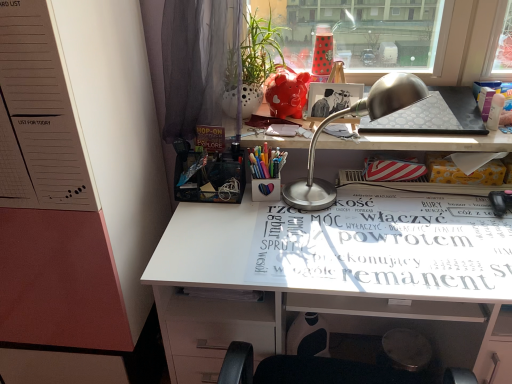
Question: Is white glossy desk at center in front of translucent plastic bottle at upper right, the second stationery from the bottom?

Choices:
 (A) no
 (B) yes

Answer: (B)

Question: From a real-world perspective, is white glossy desk at center below translucent plastic bottle at upper right, marked as the 1th stationery in a top-to-bottom arrangement?

Choices:
 (A) yes
 (B) no

Answer: (A)

Question: Can we say white glossy desk at center lies outside translucent plastic bottle at upper right, acting as the 2th stationery starting from the left?

Choices:
 (A) yes
 (B) no

Answer: (A)

Question: From the image's perspective, is white glossy desk at center below translucent plastic bottle at upper right, acting as the 2th stationery starting from the left?

Choices:
 (A) yes
 (B) no

Answer: (A)

Question: From a real-world perspective, is white glossy desk at center physically above translucent plastic bottle at upper right, acting as the 2th stationery starting from the left?

Choices:
 (A) yes
 (B) no

Answer: (B)

Question: Is point (417, 225) closer or farther from the camera than point (497, 120)?

Choices:
 (A) farther
 (B) closer

Answer: (B)

Question: In terms of height, does white paper magazine at center look taller or shorter compared to translucent plastic bottle at upper right, the second stationery from the bottom?

Choices:
 (A) tall
 (B) short

Answer: (B)

Question: Is white paper magazine at center in front of or behind translucent plastic bottle at upper right, the second stationery from the bottom, in the image?

Choices:
 (A) front
 (B) behind

Answer: (A)

Question: In terms of width, does white paper magazine at center look wider or thinner when compared to translucent plastic bottle at upper right, acting as the 2th stationery starting from the left?

Choices:
 (A) thin
 (B) wide

Answer: (B)

Question: From their relative heights in the image, would you say white glossy desk at center is taller or shorter than white paper magazine at center?

Choices:
 (A) short
 (B) tall

Answer: (B)

Question: From the image's perspective, relative to white paper magazine at center, is white glossy desk at center above or below?

Choices:
 (A) above
 (B) below

Answer: (B)

Question: Is point (189, 253) closer or farther from the camera than point (487, 276)?

Choices:
 (A) farther
 (B) closer

Answer: (A)

Question: Is white glossy desk at center wider or thinner than white paper magazine at center?

Choices:
 (A) thin
 (B) wide

Answer: (A)

Question: Is silver metallic desk lamp at upper center situated inside white dotted pot at upper center or outside?

Choices:
 (A) outside
 (B) inside

Answer: (A)

Question: From a real-world perspective, relative to white dotted pot at upper center, is silver metallic desk lamp at upper center vertically above or below?

Choices:
 (A) above
 (B) below

Answer: (B)